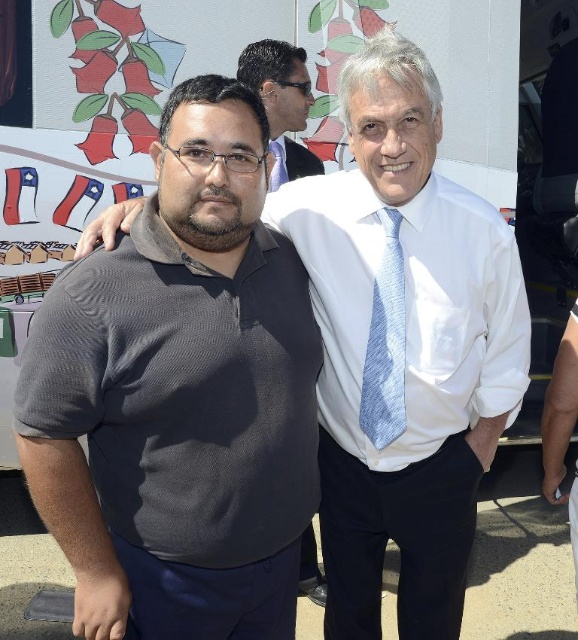
Question: Is light blue textured tie at center wider than matte black shirt at upper center?

Choices:
 (A) no
 (B) yes

Answer: (A)

Question: Does dark gray knit polo shirt at left have a larger size compared to blue textured tie at center?

Choices:
 (A) yes
 (B) no

Answer: (A)

Question: Which point is closer to the camera taking this photo?

Choices:
 (A) (394, 403)
 (B) (277, 292)
 (C) (287, 170)

Answer: (B)

Question: Which of the following is the farthest from the observer?

Choices:
 (A) blue textured tie at center
 (B) light blue textured tie at center

Answer: (A)

Question: Estimate the real-world distances between objects in this image. Which object is closer to the blue textured tie at center?

Choices:
 (A) matte black shirt at upper center
 (B) light blue textured tie at center

Answer: (A)

Question: Does dark gray knit polo shirt at left lie in front of matte black shirt at upper center?

Choices:
 (A) no
 (B) yes

Answer: (B)